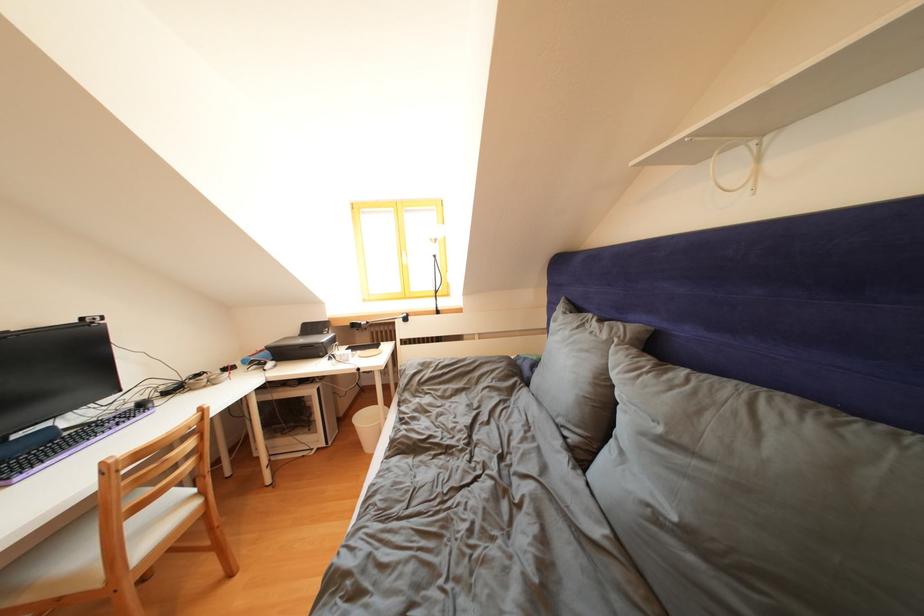
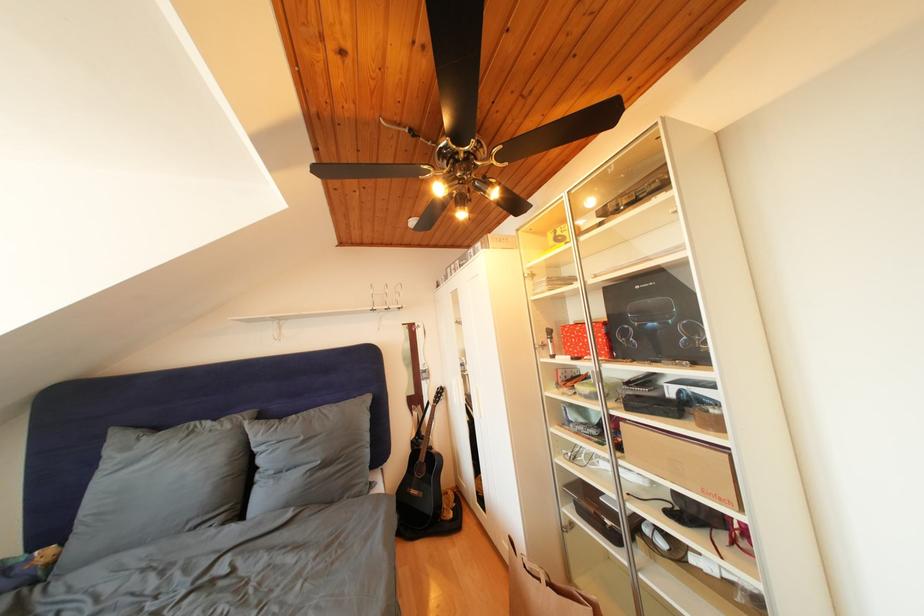
Locate, in the second image, the point that corresponds to point 667,435 in the first image.

(310, 444)